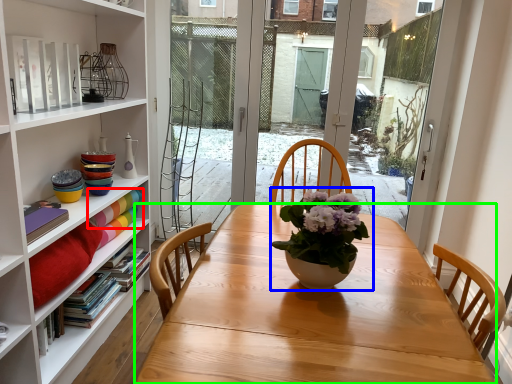
Question: Which is farther away from book (highlighted by a red box)? houseplant (highlighted by a blue box) or desk (highlighted by a green box)?

Choices:
 (A) houseplant
 (B) desk

Answer: (A)